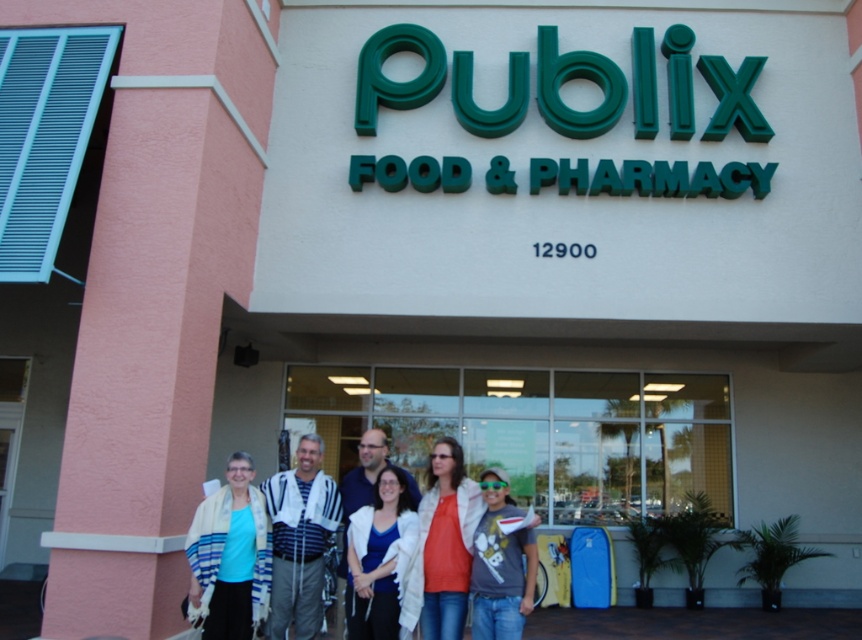
Question: Among these objects, which one is farthest from the camera?

Choices:
 (A) white matte jacket at center
 (B) white textured shawl at center
 (C) blue t-shirt at center

Answer: (B)

Question: Does blue t-shirt at center appear on the right side of matte orange shirt at center?

Choices:
 (A) yes
 (B) no

Answer: (B)

Question: Which point is closer to the camera taking this photo?

Choices:
 (A) (394, 525)
 (B) (278, 486)
 (C) (498, 540)

Answer: (C)

Question: Which point is farther to the camera?

Choices:
 (A) matte orange shirt at center
 (B) blue t-shirt at center
 (C) denim jeans at center
 (D) striped fabric shirt at center

Answer: (D)

Question: Can you confirm if white matte jacket at center is bigger than white textured shawl at center?

Choices:
 (A) yes
 (B) no

Answer: (B)

Question: Does white matte jacket at center have a greater width compared to white textured shawl at center?

Choices:
 (A) yes
 (B) no

Answer: (B)